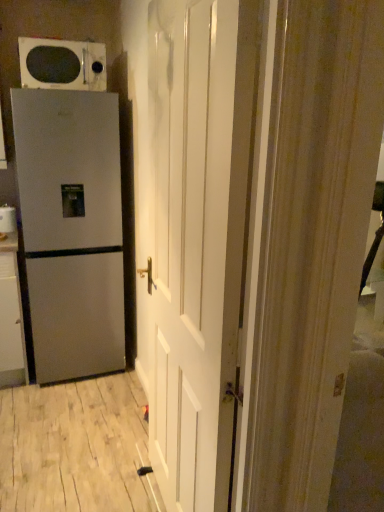
Consider the image. In order to face satin silver refrigerator at left, should I rotate leftwards or rightwards?

Rotate left and turn 15.801 degrees.

What do you see at coordinates (8, 219) in the screenshot?
I see `satin silver refrigerator at left` at bounding box center [8, 219].

Describe the element at coordinates (11, 317) in the screenshot. The image size is (384, 512). I see `white glossy cabinet at left` at that location.

What do you see at coordinates (62, 64) in the screenshot?
I see `white glossy microwave at upper left` at bounding box center [62, 64].

Locate an element on the screen. The height and width of the screenshot is (512, 384). satin silver refrigerator at left is located at coordinates (71, 229).

Where is `door lying on the right of satin silver refrigerator at left`? The height and width of the screenshot is (512, 384). door lying on the right of satin silver refrigerator at left is located at coordinates (194, 242).

Relative to satin silver refrigerator at left, is white glossy door at center in front or behind?

In the image, white glossy door at center appears in front of satin silver refrigerator at left.

Who is smaller, white glossy door at center or satin silver refrigerator at left?

white glossy door at center is smaller.

Is white glossy door at center oriented away from satin silver refrigerator at left?

No, satin silver refrigerator at left is not at the back of white glossy door at center.

From the image's perspective, which is below, satin silver refrigerator at left or white glossy cabinet at left?

white glossy cabinet at left is shown below in the image.

Can you tell me how much satin silver refrigerator at left and white glossy cabinet at left differ in facing direction?

There is a 6.6-degree angle between the facing directions of satin silver refrigerator at left and white glossy cabinet at left.

Is white glossy cabinet at left at the back of satin silver refrigerator at left?

No, satin silver refrigerator at left is not facing the opposite direction of white glossy cabinet at left.

Is satin silver refrigerator at left inside the boundaries of white glossy cabinet at left, or outside?

satin silver refrigerator at left is spatially situated outside white glossy cabinet at left.

Is white glossy microwave at upper left a part of white glossy cabinet at left?

Actually, white glossy microwave at upper left is outside white glossy cabinet at left.

Considering the points (0, 349) and (46, 87), which point is behind, point (0, 349) or point (46, 87)?

The point (0, 349) is more distant.

Can you see white glossy cabinet at left touching white glossy microwave at upper left?

There is a gap between white glossy cabinet at left and white glossy microwave at upper left.

Is white glossy cabinet at left smaller than white glossy microwave at upper left?

No.

Considering the relative sizes of white glossy microwave at upper left and satin silver refrigerator at left in the image provided, is white glossy microwave at upper left wider than satin silver refrigerator at left?

In fact, white glossy microwave at upper left might be narrower than satin silver refrigerator at left.

Which object is positioned more to the right, white glossy microwave at upper left or satin silver refrigerator at left?

white glossy microwave at upper left is more to the right.

Which of these two, white glossy microwave at upper left or satin silver refrigerator at left, stands shorter?

white glossy microwave at upper left.

Is white glossy microwave at upper left further to the viewer compared to satin silver refrigerator at left?

Yes, white glossy microwave at upper left is behind satin silver refrigerator at left.

Are satin silver refrigerator at left and white glossy microwave at upper left making contact?

No, satin silver refrigerator at left is not beside white glossy microwave at upper left.

Looking at this image, would you say satin silver refrigerator at left is outside white glossy microwave at upper left?

Indeed, satin silver refrigerator at left is completely outside white glossy microwave at upper left.

Considering the relative sizes of satin silver refrigerator at left and white glossy microwave at upper left in the image provided, is satin silver refrigerator at left shorter than white glossy microwave at upper left?

Incorrect, the height of satin silver refrigerator at left does not fall short of that of white glossy microwave at upper left.

What's the angular difference between satin silver refrigerator at left and white glossy microwave at upper left's facing directions?

The angle between the facing direction of satin silver refrigerator at left and the facing direction of white glossy microwave at upper left is 2.64 degrees.

Does white glossy microwave at upper left have a lesser width compared to white glossy cabinet at left?

Yes.

From a real-world perspective, is white glossy microwave at upper left physically above white glossy cabinet at left?

Yes, from a real-world perspective, white glossy microwave at upper left is on top of white glossy cabinet at left.

Which object is closer to the camera taking this photo, white glossy microwave at upper left or white glossy cabinet at left?

white glossy microwave at upper left is in front.

Does white glossy microwave at upper left have a smaller size compared to white glossy cabinet at left?

Indeed, white glossy microwave at upper left has a smaller size compared to white glossy cabinet at left.

Considering their positions, is satin silver refrigerator at left located in front of or behind white glossy microwave at upper left?

Clearly, satin silver refrigerator at left is behind white glossy microwave at upper left.

Is satin silver refrigerator at left taller or shorter than white glossy microwave at upper left?

satin silver refrigerator at left is shorter than white glossy microwave at upper left.

Is the surface of satin silver refrigerator at left in direct contact with white glossy microwave at upper left?

No, satin silver refrigerator at left is not making contact with white glossy microwave at upper left.

From a real-world perspective, is satin silver refrigerator at left under white glossy microwave at upper left?

Yes.

Identify the location of refrigerator on the left of white glossy door at center. (71, 229).

Locate an element on the screen. appliance that is above the white glossy cabinet at left (from a real-world perspective) is located at coordinates (8, 219).

When comparing their distances from satin silver refrigerator at left, does white glossy cabinet at left or white glossy door at center seem closer?

Based on the image, white glossy cabinet at left appears to be nearer to satin silver refrigerator at left.

When comparing their distances from satin silver refrigerator at left, does satin silver refrigerator at left or white glossy microwave at upper left seem closer?

white glossy microwave at upper left is closer to satin silver refrigerator at left.

Estimate the real-world distances between objects in this image. Which object is closer to white glossy cabinet at left, white glossy microwave at upper left or satin silver refrigerator at left?

satin silver refrigerator at left is closer to white glossy cabinet at left.

Based on their spatial positions, is white glossy door at center or satin silver refrigerator at left closer to white glossy microwave at upper left?

Based on the image, satin silver refrigerator at left appears to be nearer to white glossy microwave at upper left.

Which object lies nearer to the anchor point satin silver refrigerator at left, white glossy door at center or satin silver refrigerator at left?

satin silver refrigerator at left lies closer to satin silver refrigerator at left than the other object.

When comparing their distances from white glossy microwave at upper left, does satin silver refrigerator at left or white glossy cabinet at left seem further?

white glossy cabinet at left is positioned further to the anchor white glossy microwave at upper left.

Considering their positions, is satin silver refrigerator at left positioned further to white glossy cabinet at left than white glossy microwave at upper left?

Based on the image, white glossy microwave at upper left appears to be further to white glossy cabinet at left.

When comparing their distances from satin silver refrigerator at left, does white glossy cabinet at left or white glossy microwave at upper left seem further?

white glossy microwave at upper left is positioned further to the anchor satin silver refrigerator at left.

Where is `appliance that lies between white glossy microwave at upper left and white glossy cabinet at left from top to bottom`? The image size is (384, 512). appliance that lies between white glossy microwave at upper left and white glossy cabinet at left from top to bottom is located at coordinates (8, 219).

Find the location of `refrigerator located between white glossy door at center and satin silver refrigerator at left in the depth direction`. refrigerator located between white glossy door at center and satin silver refrigerator at left in the depth direction is located at coordinates (71, 229).

Identify the location of refrigerator between satin silver refrigerator at left and white glossy cabinet at left in the up-down direction. (71, 229).

Where is `refrigerator that lies between white glossy microwave at upper left and white glossy cabinet at left from top to bottom`? refrigerator that lies between white glossy microwave at upper left and white glossy cabinet at left from top to bottom is located at coordinates (71, 229).